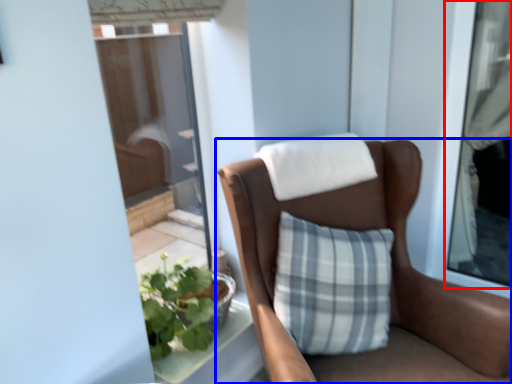
Question: Which object appears closest to the camera in this image, window (highlighted by a red box) or chair (highlighted by a blue box)?

Choices:
 (A) window
 (B) chair

Answer: (B)